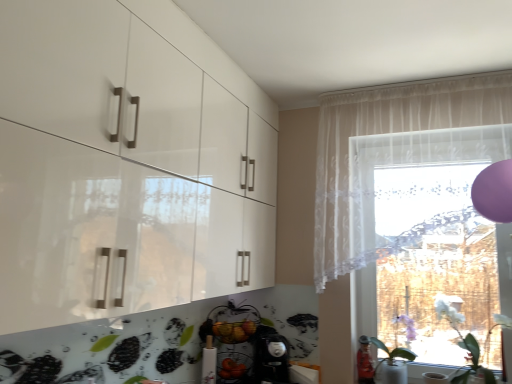
Question: Does sheer white curtain at upper right turn towards white matte plant at lower right, which ranks as the second plant in left-to-right order?

Choices:
 (A) no
 (B) yes

Answer: (A)

Question: Is white matte plant at lower right, which ranks as the 1th plant in right-to-left order, at the back of sheer white curtain at upper right?

Choices:
 (A) yes
 (B) no

Answer: (B)

Question: Can you confirm if sheer white curtain at upper right is taller than white matte plant at lower right, which ranks as the 1th plant in right-to-left order?

Choices:
 (A) no
 (B) yes

Answer: (B)

Question: Can you confirm if sheer white curtain at upper right is wider than white matte plant at lower right, which ranks as the 1th plant in right-to-left order?

Choices:
 (A) yes
 (B) no

Answer: (B)

Question: Is there a large distance between sheer white curtain at upper right and white matte plant at lower right, which ranks as the 1th plant in right-to-left order?

Choices:
 (A) yes
 (B) no

Answer: (B)

Question: Relative to transparent lace curtain at right, is sheer white curtain at upper right in front or behind?

Choices:
 (A) behind
 (B) front

Answer: (B)

Question: Would you say sheer white curtain at upper right is to the left or to the right of transparent lace curtain at right in the picture?

Choices:
 (A) right
 (B) left

Answer: (B)

Question: Considering the positions of sheer white curtain at upper right and transparent lace curtain at right in the image, is sheer white curtain at upper right wider or thinner than transparent lace curtain at right?

Choices:
 (A) wide
 (B) thin

Answer: (B)

Question: From the image's perspective, is sheer white curtain at upper right positioned above or below transparent lace curtain at right?

Choices:
 (A) above
 (B) below

Answer: (A)

Question: From a real-world perspective, is white glossy vase at lower right, which ranks as the 2th plant in right-to-left order, positioned above or below transparent lace curtain at right?

Choices:
 (A) below
 (B) above

Answer: (A)

Question: From the image's perspective, is white glossy vase at lower right, arranged as the 1th plant when viewed from the left, above or below transparent lace curtain at right?

Choices:
 (A) above
 (B) below

Answer: (B)

Question: Based on their positions, is white glossy vase at lower right, which ranks as the 2th plant in right-to-left order, located to the left or right of transparent lace curtain at right?

Choices:
 (A) left
 (B) right

Answer: (A)

Question: Looking at the image, does white glossy vase at lower right, arranged as the 1th plant when viewed from the left, seem bigger or smaller compared to transparent lace curtain at right?

Choices:
 (A) small
 (B) big

Answer: (A)

Question: In terms of height, does transparent lace curtain at right look taller or shorter compared to white glossy vase at lower right, which ranks as the 2th plant in right-to-left order?

Choices:
 (A) short
 (B) tall

Answer: (B)

Question: Considering the positions of point (481, 238) and point (378, 382), is point (481, 238) closer or farther from the camera than point (378, 382)?

Choices:
 (A) closer
 (B) farther

Answer: (A)